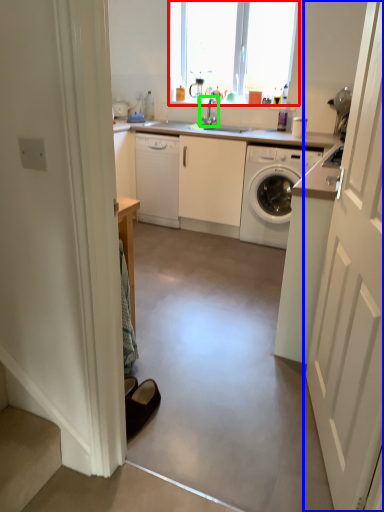
Question: Based on their relative distances, which object is nearer to window (highlighted by a red box)? Choose from door (highlighted by a blue box) and tap (highlighted by a green box).

Choices:
 (A) door
 (B) tap

Answer: (B)